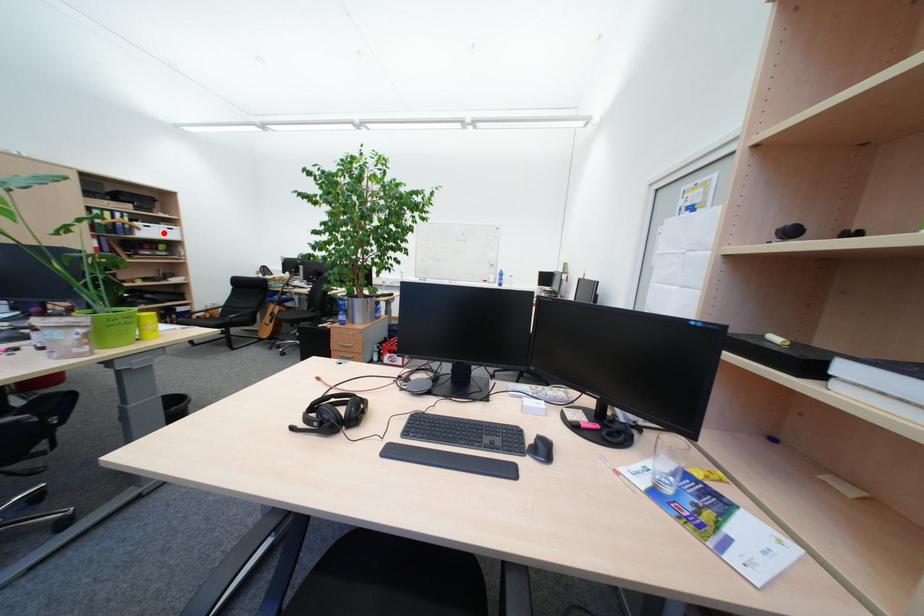
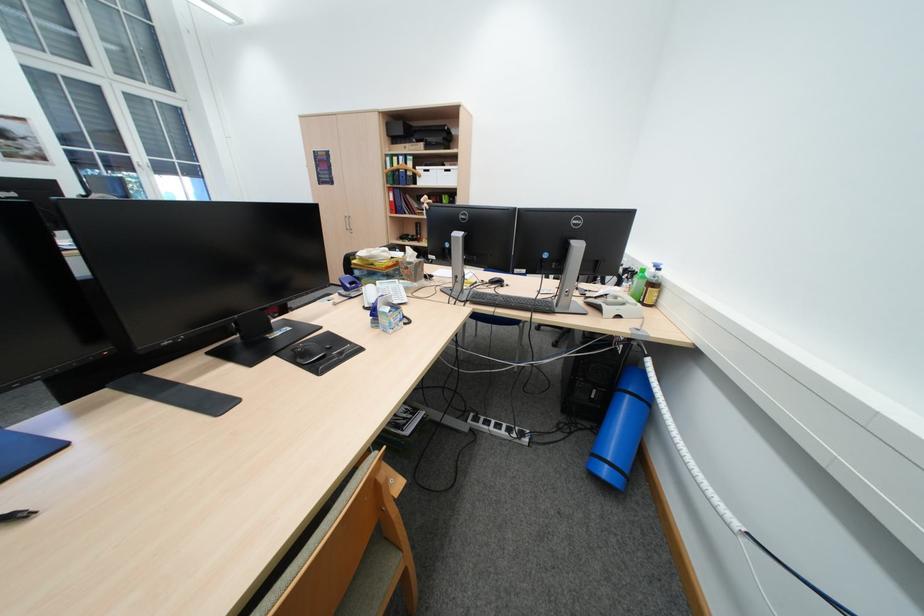
Find the pixel in the second image that matches the highlighted location in the first image.

(442, 179)